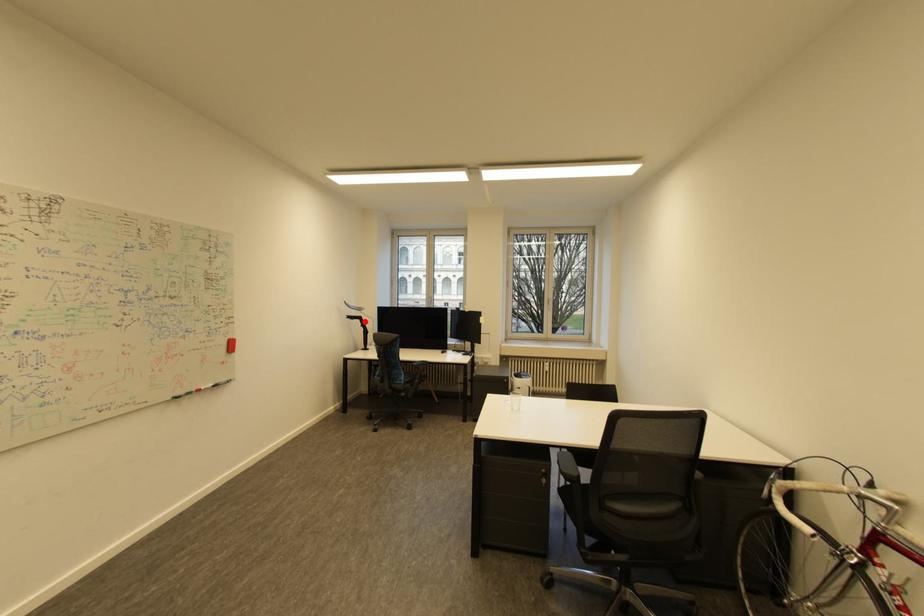
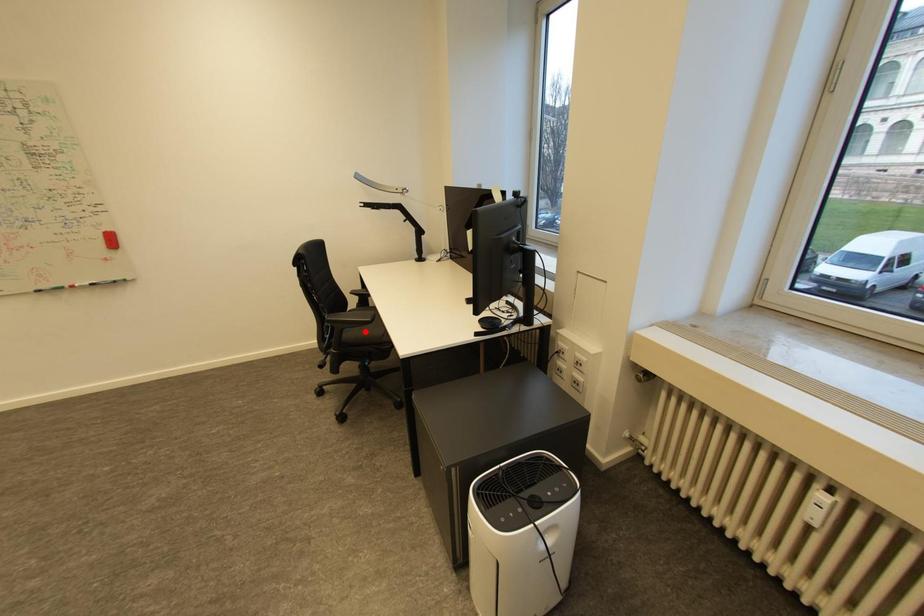
I am providing you with two images of the same scene from different viewpoints. A red point is marked on the first image and another point is marked on the second image. Is the marked point in image1 the same physical position as the marked point in image2?

No